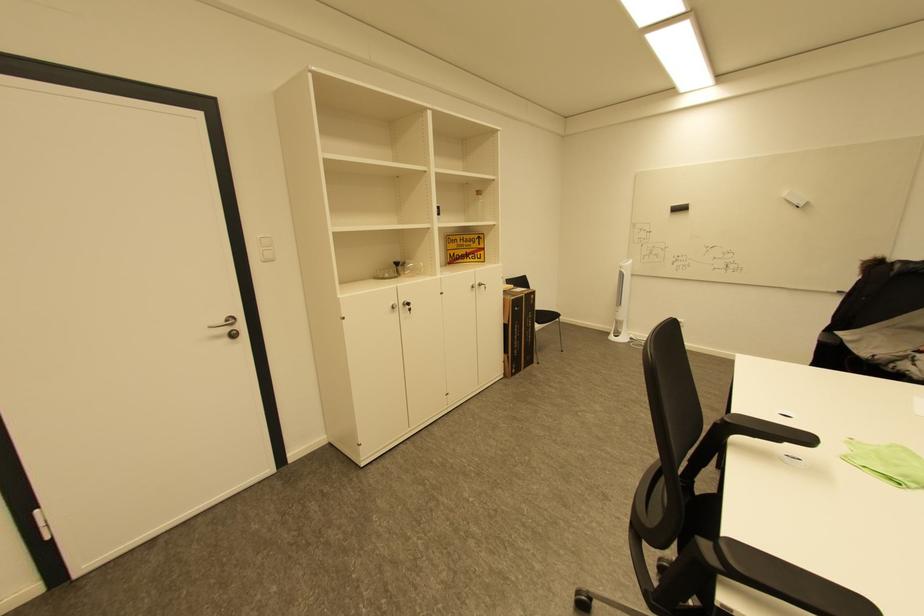
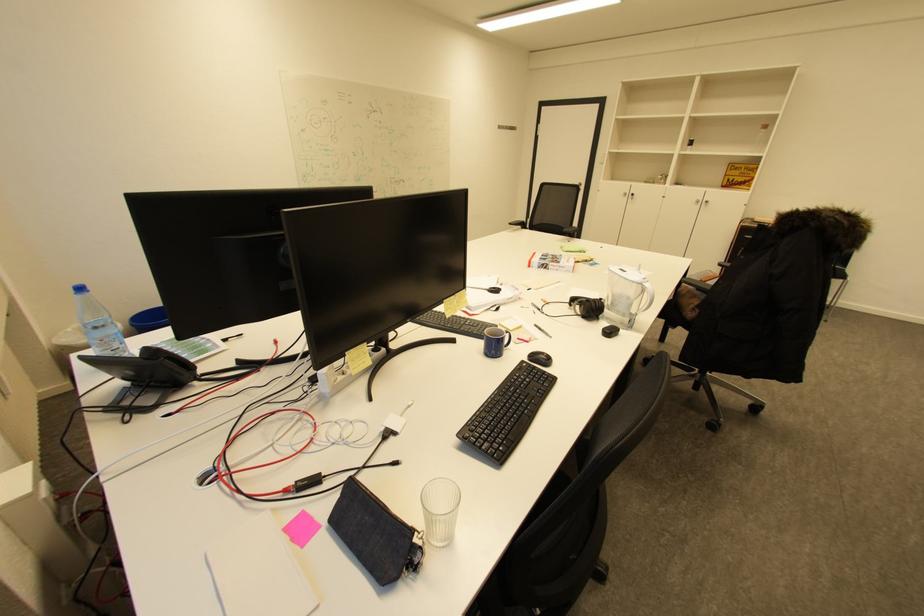
In the second image, find the point that corresponds to (398,308) in the first image.

(630, 195)